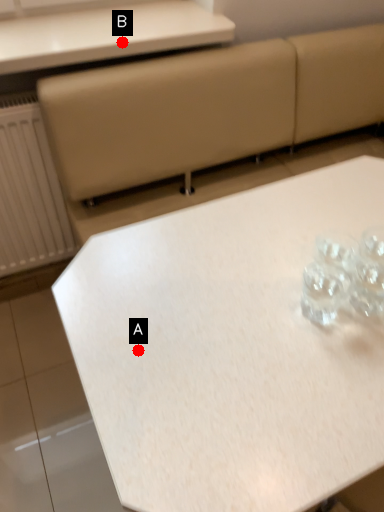
Question: Two points are circled on the image, labeled by A and B beside each circle. Which point is further to the camera?

Choices:
 (A) A is further
 (B) B is further

Answer: (B)